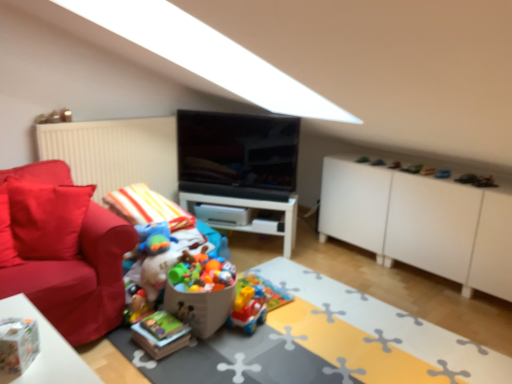
Question: From a real-world perspective, does brightly colored plastic toys at center, the 2th toy positioned from the right, sit lower than matte red couch at left?

Choices:
 (A) no
 (B) yes

Answer: (B)

Question: From the image's perspective, would you say brightly colored plastic toys at center, the 2th toy positioned from the right, is shown under matte red couch at left?

Choices:
 (A) no
 (B) yes

Answer: (B)

Question: Is brightly colored plastic toys at center, which is the 1th toy in left-to-right order, smaller than matte red couch at left?

Choices:
 (A) yes
 (B) no

Answer: (A)

Question: Is brightly colored plastic toys at center, the 2th toy positioned from the right, surrounding matte red couch at left?

Choices:
 (A) no
 (B) yes

Answer: (A)

Question: From a real-world perspective, does brightly colored plastic toys at center, the 2th toy positioned from the right, stand above matte red couch at left?

Choices:
 (A) no
 (B) yes

Answer: (A)

Question: Considering the relative sizes of brightly colored plastic toys at center, the 2th toy positioned from the right, and matte red couch at left in the image provided, is brightly colored plastic toys at center, the 2th toy positioned from the right, wider than matte red couch at left?

Choices:
 (A) yes
 (B) no

Answer: (B)

Question: Is matte red couch at left looking in the opposite direction of black glossy tv at center?

Choices:
 (A) yes
 (B) no

Answer: (B)

Question: Considering the relative sizes of matte red couch at left and black glossy tv at center in the image provided, is matte red couch at left thinner than black glossy tv at center?

Choices:
 (A) no
 (B) yes

Answer: (A)

Question: Is matte red couch at left beside black glossy tv at center?

Choices:
 (A) yes
 (B) no

Answer: (B)

Question: Is matte red couch at left to the right of black glossy tv at center from the viewer's perspective?

Choices:
 (A) yes
 (B) no

Answer: (B)

Question: Is matte red couch at left aimed at black glossy tv at center?

Choices:
 (A) no
 (B) yes

Answer: (A)

Question: From the image's perspective, would you say matte red couch at left is positioned over black glossy tv at center?

Choices:
 (A) yes
 (B) no

Answer: (B)

Question: From the image's perspective, is black glossy tv at center above plastic colorful toy car at center, placed as the 1th toy when sorted from right to left?

Choices:
 (A) yes
 (B) no

Answer: (A)